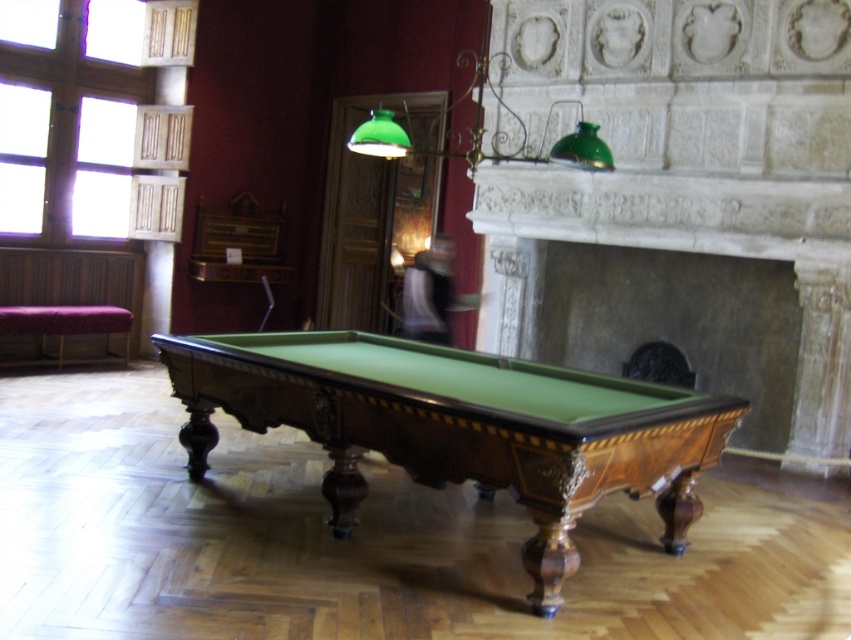
Does white marble fireplace at center have a larger size compared to green felt pool table at center?

Yes, white marble fireplace at center is bigger than green felt pool table at center.

Is white marble fireplace at center thinner than green felt pool table at center?

Yes, white marble fireplace at center is thinner than green felt pool table at center.

Locate an element on the screen. Image resolution: width=851 pixels, height=640 pixels. white marble fireplace at center is located at coordinates (681, 198).

Locate an element on the screen. This screenshot has width=851, height=640. white marble fireplace at center is located at coordinates (681, 198).

Is white marble fireplace at center smaller than purple fabric bench at left?

No, white marble fireplace at center is not smaller than purple fabric bench at left.

Describe the element at coordinates (681, 198) in the screenshot. I see `white marble fireplace at center` at that location.

This screenshot has width=851, height=640. I want to click on white marble fireplace at center, so click(x=681, y=198).

Does green enameled metal wall lamp at upper center appear on the left side of purple fabric bench at left?

Incorrect, green enameled metal wall lamp at upper center is not on the left side of purple fabric bench at left.

Locate an element on the screen. The height and width of the screenshot is (640, 851). green enameled metal wall lamp at upper center is located at coordinates (483, 131).